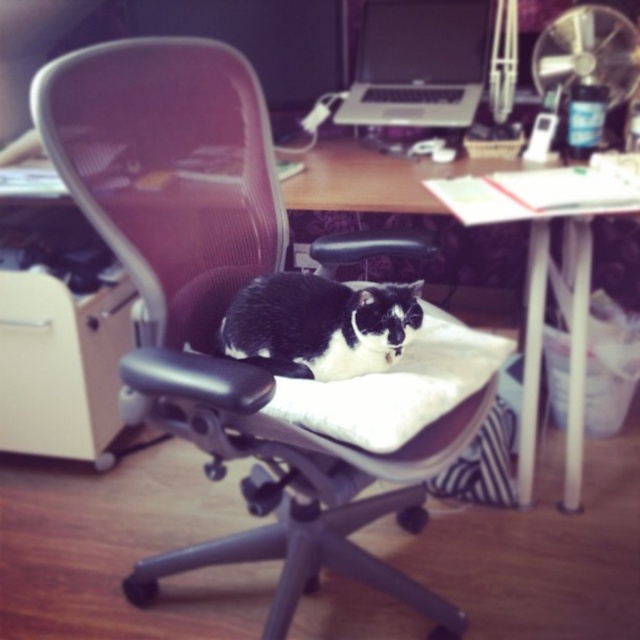
Based on the photo, you are standing in the room and want to place a small plant between the two points, point (422, 168) and point (342, 372). Which point should you place the plant closer to so it is closer to you?

You should place the plant closer to point (422, 168) because it is closer to you than point (342, 372).

You need to place a new keyboard that is the same size as the black glossy monitor at upper center onto the wooden desk at center. Will it fit?

The wooden desk at center is bigger than the black glossy monitor at upper center, so the keyboard, being the same size as the monitor, will fit on the wooden desk at center.